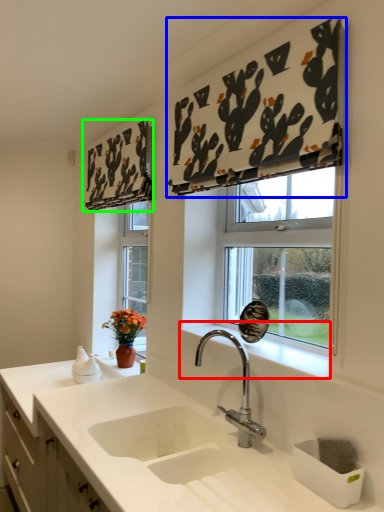
Question: Estimate the real-world distances between objects in this image. Which object is farther from window sill (highlighted by a red box), curtain (highlighted by a blue box) or curtain (highlighted by a green box)?

Choices:
 (A) curtain
 (B) curtain

Answer: (B)